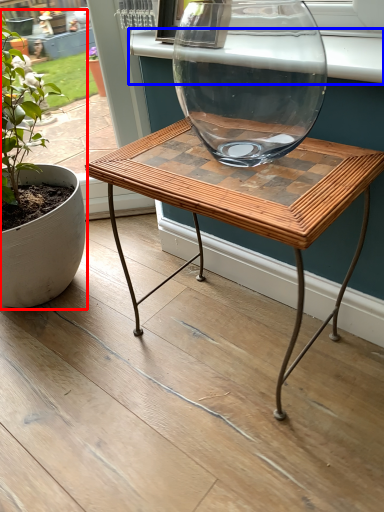
Question: Which of the following is the farthest to the observer, houseplant (highlighted by a red box) or window sill (highlighted by a blue box)?

Choices:
 (A) houseplant
 (B) window sill

Answer: (B)